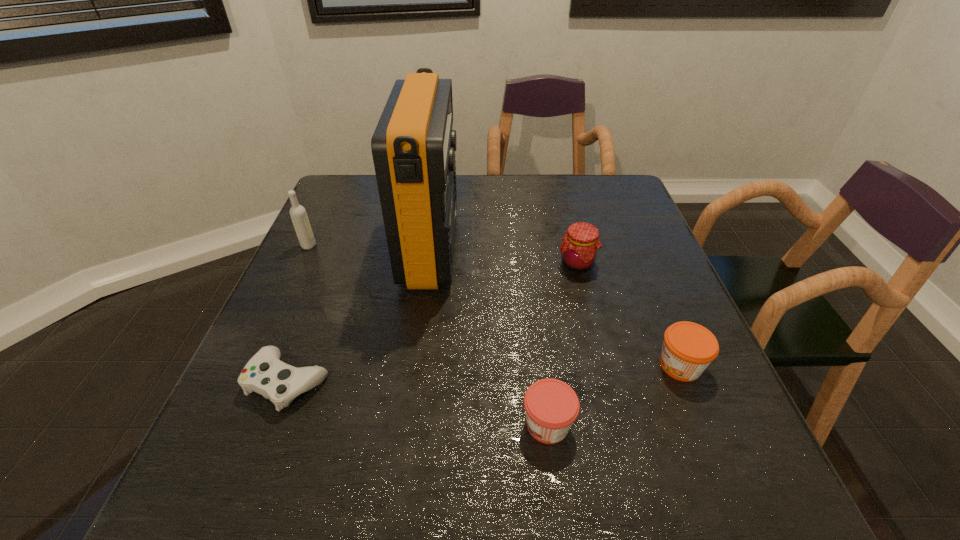
Locate an element on the screen. object that is the third nearest to the nearest jam is located at coordinates (579, 249).

Find the location of `jam that can be found as the second closest to the shortest object`. jam that can be found as the second closest to the shortest object is located at coordinates (579, 249).

Where is `jam identified as the second closest to the rightmost jam`? This screenshot has width=960, height=540. jam identified as the second closest to the rightmost jam is located at coordinates (579, 249).

Where is `blank space that satisfies the following two spatial constraints: 1. on the back side of the second object from right to left; 2. on the front-facing side of the tallest object`? This screenshot has width=960, height=540. blank space that satisfies the following two spatial constraints: 1. on the back side of the second object from right to left; 2. on the front-facing side of the tallest object is located at coordinates (573, 248).